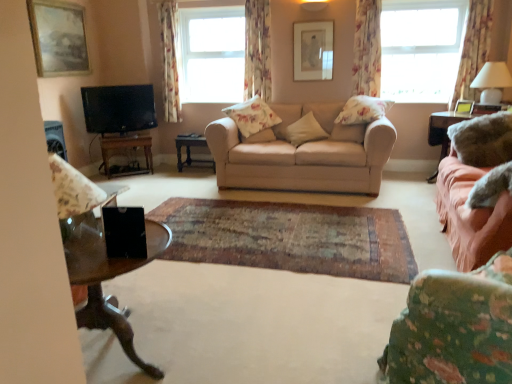
Question: Does transparent glass coffee table at lower left have a lesser height compared to white fabric lampshade at upper right?

Choices:
 (A) yes
 (B) no

Answer: (B)

Question: From a real-world perspective, is transparent glass coffee table at lower left physically above white fabric lampshade at upper right?

Choices:
 (A) no
 (B) yes

Answer: (A)

Question: From the image's perspective, would you say transparent glass coffee table at lower left is shown under white fabric lampshade at upper right?

Choices:
 (A) yes
 (B) no

Answer: (A)

Question: Does transparent glass coffee table at lower left have a larger size compared to white fabric lampshade at upper right?

Choices:
 (A) no
 (B) yes

Answer: (B)

Question: From a real-world perspective, is transparent glass coffee table at lower left located beneath white fabric lampshade at upper right?

Choices:
 (A) no
 (B) yes

Answer: (B)

Question: Is transparent glass coffee table at lower left behind white fabric lampshade at upper right?

Choices:
 (A) yes
 (B) no

Answer: (B)

Question: Considering the relative sizes of matte floral fabric armchair at left and floral fabric curtain at right, the third curtain when ordered from left to right, in the image provided, is matte floral fabric armchair at left shorter than floral fabric curtain at right, the third curtain when ordered from left to right,?

Choices:
 (A) yes
 (B) no

Answer: (A)

Question: Considering the relative sizes of matte floral fabric armchair at left and floral fabric curtain at right, marked as the second curtain in a right-to-left arrangement, in the image provided, is matte floral fabric armchair at left thinner than floral fabric curtain at right, marked as the second curtain in a right-to-left arrangement,?

Choices:
 (A) yes
 (B) no

Answer: (B)

Question: Does matte floral fabric armchair at left have a greater width compared to floral fabric curtain at right, the third curtain when ordered from left to right?

Choices:
 (A) yes
 (B) no

Answer: (A)

Question: Is matte floral fabric armchair at left bigger than floral fabric curtain at right, marked as the second curtain in a right-to-left arrangement?

Choices:
 (A) yes
 (B) no

Answer: (A)

Question: Is matte floral fabric armchair at left at the right side of floral fabric curtain at right, the third curtain when ordered from left to right?

Choices:
 (A) no
 (B) yes

Answer: (A)

Question: Is the position of matte floral fabric armchair at left more distant than that of floral fabric curtain at right, the third curtain when ordered from left to right?

Choices:
 (A) yes
 (B) no

Answer: (B)

Question: Considering the relative positions of floral fabric pillow at center, the fourth pillow from the right, and satin pink fabric at right, marked as the first table in a right-to-left arrangement, in the image provided, is floral fabric pillow at center, the fourth pillow from the right, behind satin pink fabric at right, marked as the first table in a right-to-left arrangement,?

Choices:
 (A) no
 (B) yes

Answer: (B)